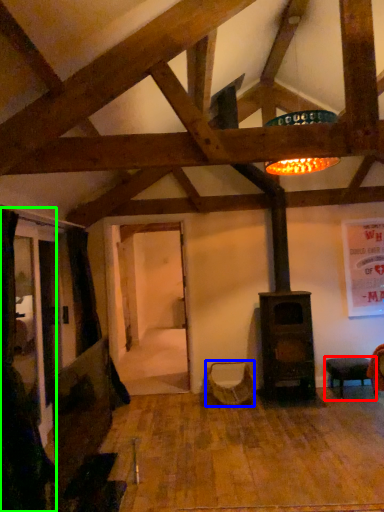
Question: Which object is the closest to the furniture (highlighted by a red box)? Choose among these: swivel chair (highlighted by a blue box) or curtain (highlighted by a green box).

Choices:
 (A) swivel chair
 (B) curtain

Answer: (A)